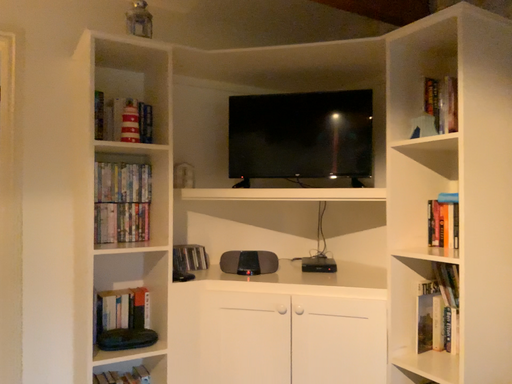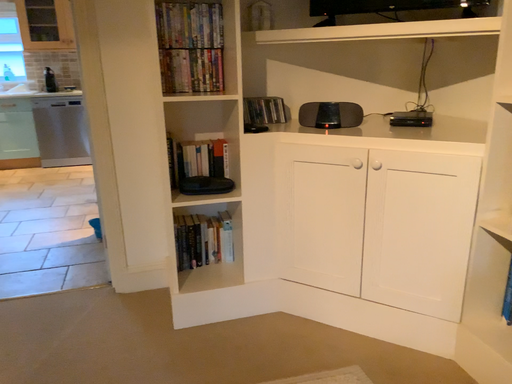
Question: How did the camera likely rotate when shooting the video?

Choices:
 (A) rotated downward
 (B) rotated upward

Answer: (A)